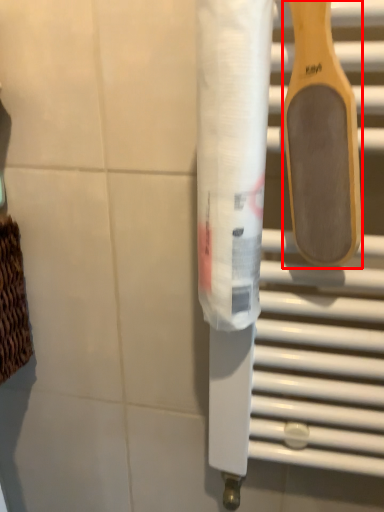
Question: From the image's perspective, what is the correct spatial relationship of spatula (annotated by the red box) in relation to toilet paper?

Choices:
 (A) below
 (B) above

Answer: (B)